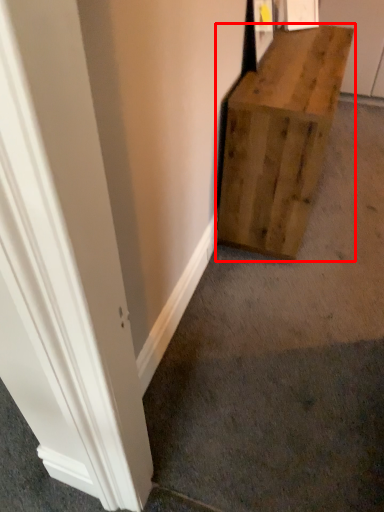
Question: Considering the relative positions of furniture (annotated by the red box) and concrete in the image provided, where is furniture (annotated by the red box) located with respect to the staircase?

Choices:
 (A) left
 (B) right

Answer: (B)